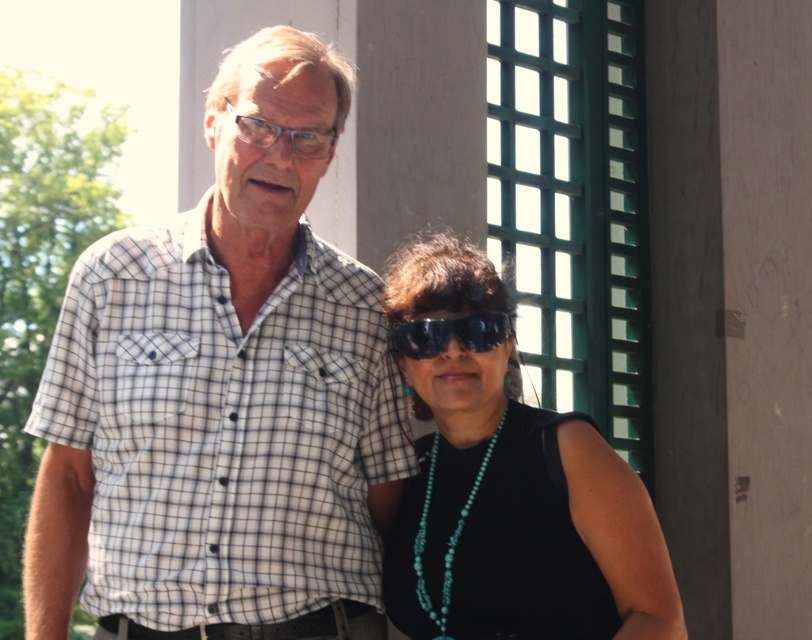
You are a photographer trying to capture a closeup of both the turquoise beaded necklace at center and the black plastic goggles at center. Since they are both at center, which one will appear larger in the photo?

The turquoise beaded necklace at center is much taller than the black plastic goggles at center, so it will appear larger in the photo.

You are taking a photo of two people standing in front of a building. You notice two points in the scene labeled as point 1 and point 2. If point 1 is at coordinates [288,465] and point 2 is at [588,420], which point is closer to you?

Point 1 at coordinates [288,465] is closer to you because it is further to the viewer than point 2 at [588,420].

You are a photographer trying to focus on the turquoise beaded necklace at center. Given that the coordinates provided are point (520, 518), where exactly is this point located relative to the woman on the right?

The point (520, 518) corresponds to the turquoise beaded necklace at center, which is located on the woman on the right.